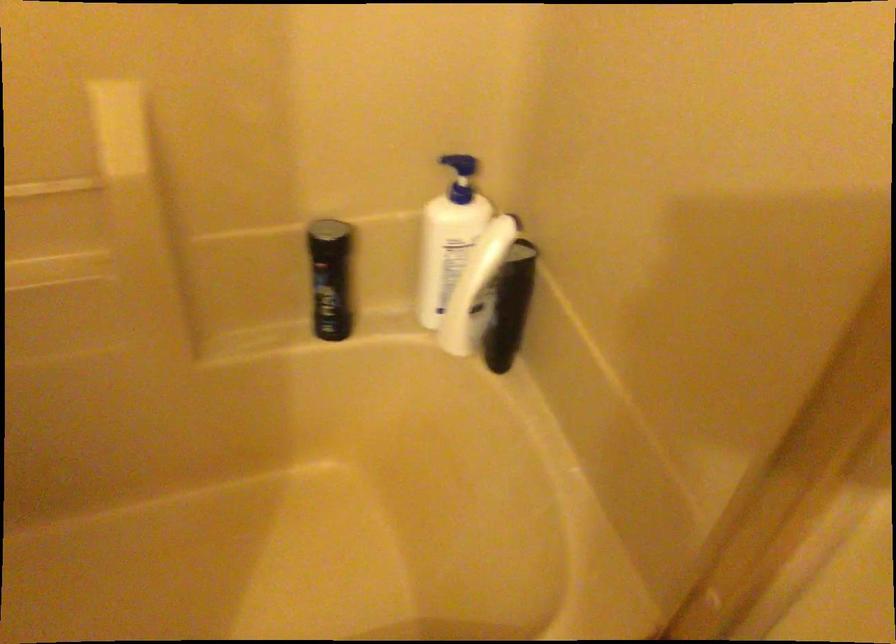
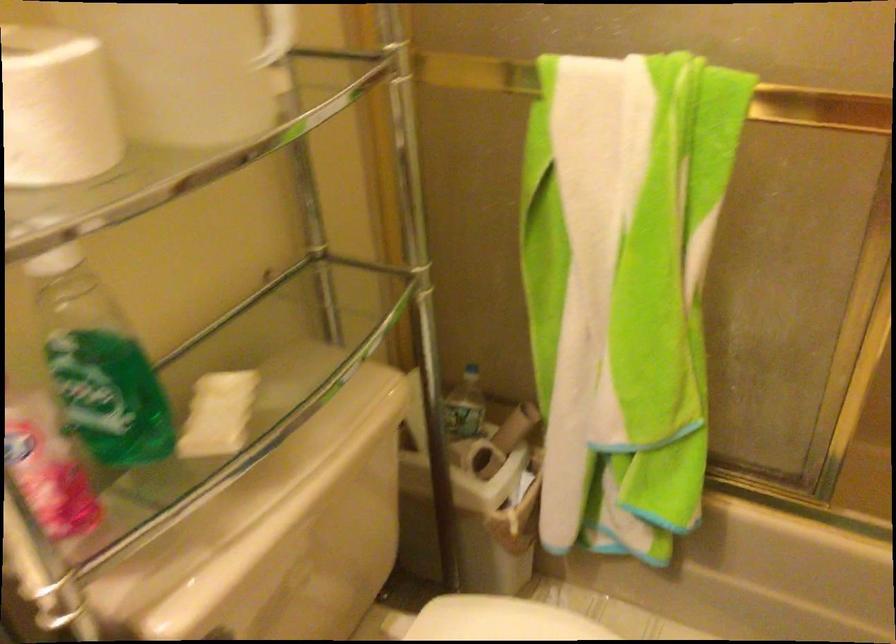
Question: The camera is either moving clockwise (left) or counter-clockwise (right) around the object. The first image is from the beginning of the video and the second image is from the end. Is the camera moving left or right when shooting the video?

Choices:
 (A) Left
 (B) Right

Answer: (B)